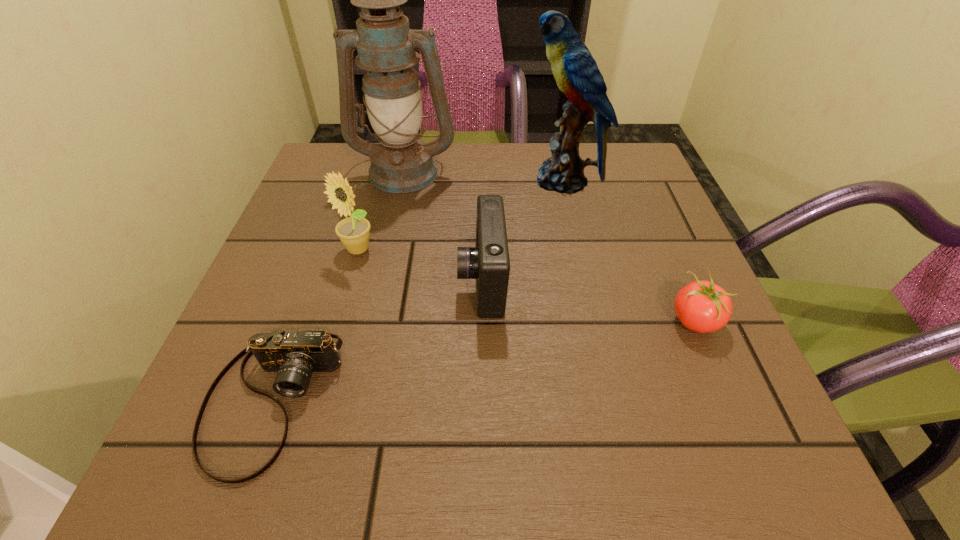
Locate an element on the screen. Image resolution: width=960 pixels, height=540 pixels. free space between the third shortest object and the oil lamp is located at coordinates (444, 226).

I want to click on vacant space in between the oil lamp and the fourth shortest object, so click(381, 211).

Where is `empty space between the rightmost object and the oil lamp`? empty space between the rightmost object and the oil lamp is located at coordinates (549, 246).

This screenshot has width=960, height=540. What are the coordinates of `free space between the taller camera and the sunflower` in the screenshot? It's located at (420, 265).

Select which object appears as the fifth closest to the fourth shortest object. Please provide its 2D coordinates. Your answer should be formatted as a tuple, i.e. [(x, y)], where the tuple contains the x and y coordinates of a point satisfying the conditions above.

[(701, 306)]

You are a GUI agent. You are given a task and a screenshot of the screen. Output one action in this format:
    pyautogui.click(x=<x>, y=<y>)
    Task: Click on the object that is the second closest to the tomato
    The height and width of the screenshot is (540, 960).
    Given the screenshot: What is the action you would take?
    pyautogui.click(x=576, y=72)

The height and width of the screenshot is (540, 960). Find the location of `free spot that satisfies the following two spatial constraints: 1. on the face of the second object from right to left; 2. on the face of the sunflower`. free spot that satisfies the following two spatial constraints: 1. on the face of the second object from right to left; 2. on the face of the sunflower is located at coordinates (578, 249).

The image size is (960, 540). I want to click on vacant space that satisfies the following two spatial constraints: 1. on the face of the tomato; 2. on the right side of the sunflower, so click(x=337, y=321).

This screenshot has height=540, width=960. In order to click on vacant space that satisfies the following two spatial constraints: 1. on the face of the tomato; 2. on the right side of the fourth shortest object in this screenshot , I will do `click(337, 321)`.